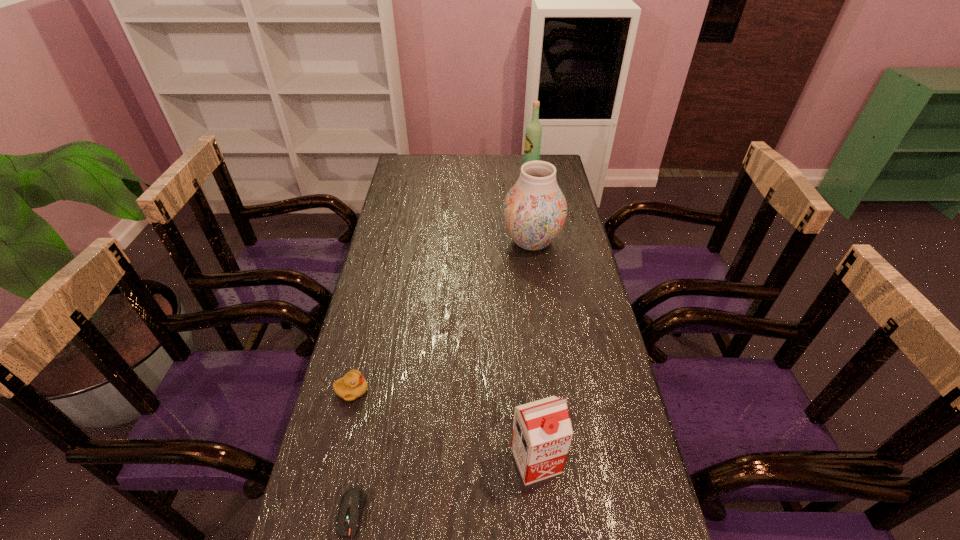
This screenshot has height=540, width=960. In the image, there is a desktop. Identify the location of vacant space at the far edge. (501, 158).

You are a GUI agent. You are given a task and a screenshot of the screen. Output one action in this format:
    pyautogui.click(x=<x>, y=<y>)
    Task: Click on the free space at the left edge
    Image resolution: width=960 pixels, height=540 pixels.
    Given the screenshot: What is the action you would take?
    pyautogui.click(x=372, y=347)

Where is `free region at the right edge`? free region at the right edge is located at coordinates (588, 502).

This screenshot has width=960, height=540. I want to click on vacant space at the far left corner of the desktop, so click(x=410, y=177).

Locate an element on the screen. Image resolution: width=960 pixels, height=540 pixels. vacant space at the far right corner of the desktop is located at coordinates (554, 160).

In order to click on vacant area that lies between the vase and the fourth tallest object in this screenshot , I will do point(442,316).

Find the location of `vacant region between the soya milk and the third farthest object`. vacant region between the soya milk and the third farthest object is located at coordinates (444, 426).

At what (x,y) coordinates should I click in order to perform the action: click on free spot between the third farthest object and the wine bottle. Please return your answer as a coordinate pair (x, y). Image resolution: width=960 pixels, height=540 pixels. Looking at the image, I should click on (442, 281).

This screenshot has width=960, height=540. Identify the location of free space between the third shortest object and the vase. (534, 351).

Where is `vacant space that is in between the duckling and the nearest object`? This screenshot has width=960, height=540. vacant space that is in between the duckling and the nearest object is located at coordinates (352, 451).